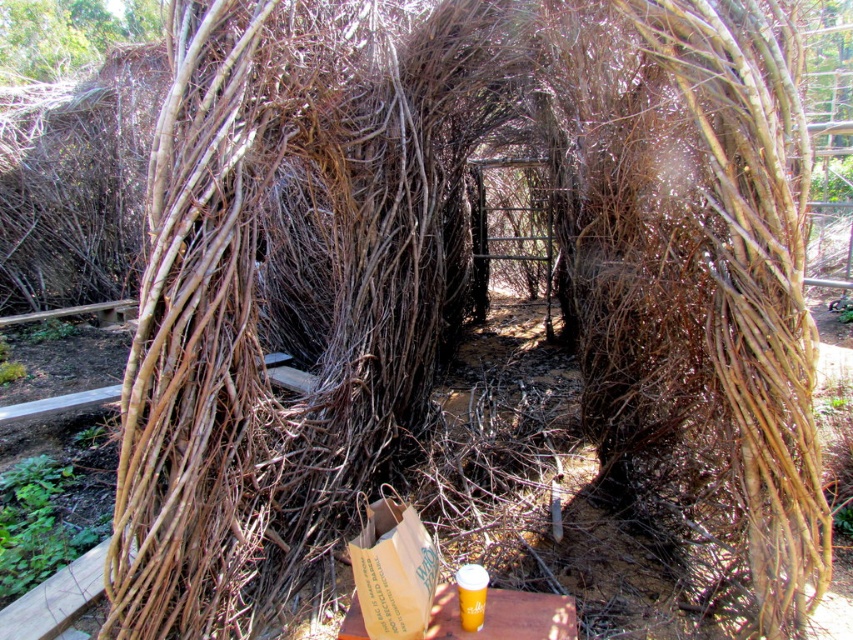
Question: From the image, what is the correct spatial relationship of brown paper bag at lower center in relation to translucent plastic cup at center?

Choices:
 (A) below
 (B) above

Answer: (B)

Question: Does brown paper bag at lower center appear under brown wood table at lower center?

Choices:
 (A) yes
 (B) no

Answer: (B)

Question: Is brown paper bag at lower center positioned in front of translucent plastic cup at center?

Choices:
 (A) yes
 (B) no

Answer: (A)

Question: Which point is closer to the camera?

Choices:
 (A) (374, 621)
 (B) (457, 584)

Answer: (A)

Question: Which point appears closest to the camera in this image?

Choices:
 (A) (459, 636)
 (B) (405, 604)
 (C) (468, 625)

Answer: (B)

Question: Which object is farther from the camera taking this photo?

Choices:
 (A) brown wood table at lower center
 (B) translucent plastic cup at center

Answer: (A)